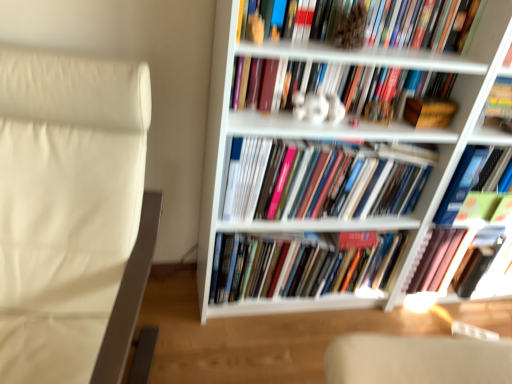
Question: In which direction should I rotate to look at multicolored paperbacks at center, acting as the fifth book starting from the top?

Choices:
 (A) left
 (B) right

Answer: (B)

Question: Considering the relative sizes of hardcover book at upper center, the first book when ordered from top to bottom, and matte hardcover books at center, the 3th book in the top-to-bottom sequence, in the image provided, is hardcover book at upper center, the first book when ordered from top to bottom, shorter than matte hardcover books at center, the 3th book in the top-to-bottom sequence,?

Choices:
 (A) no
 (B) yes

Answer: (B)

Question: From a real-world perspective, is hardcover book at upper center, the 6th book in the bottom-to-top sequence, beneath matte hardcover books at center, the 3th book in the top-to-bottom sequence?

Choices:
 (A) yes
 (B) no

Answer: (B)

Question: Is hardcover book at upper center, the first book when ordered from top to bottom, aimed at matte hardcover books at center, which is the fourth book from bottom to top?

Choices:
 (A) yes
 (B) no

Answer: (B)

Question: Does hardcover book at upper center, the first book when ordered from top to bottom, contain matte hardcover books at center, the 3th book in the top-to-bottom sequence?

Choices:
 (A) yes
 (B) no

Answer: (B)

Question: Considering the relative sizes of hardcover book at upper center, the 6th book in the bottom-to-top sequence, and matte hardcover books at center, which is the fourth book from bottom to top, in the image provided, is hardcover book at upper center, the 6th book in the bottom-to-top sequence, taller than matte hardcover books at center, which is the fourth book from bottom to top,?

Choices:
 (A) yes
 (B) no

Answer: (B)

Question: Is hardcover book at upper center, the first book when ordered from top to bottom, beside matte hardcover books at center, which is the fourth book from bottom to top?

Choices:
 (A) yes
 (B) no

Answer: (B)

Question: Considering the relative sizes of matte hardcover books at center, the 3th book in the top-to-bottom sequence, and multicolored paperbacks at center, acting as the fifth book starting from the top, in the image provided, is matte hardcover books at center, the 3th book in the top-to-bottom sequence, thinner than multicolored paperbacks at center, acting as the fifth book starting from the top,?

Choices:
 (A) yes
 (B) no

Answer: (A)

Question: Is multicolored paperbacks at center, acting as the 2th book starting from the bottom, at the back of matte hardcover books at center, which is the fourth book from bottom to top?

Choices:
 (A) no
 (B) yes

Answer: (A)

Question: Does matte hardcover books at center, the 3th book in the top-to-bottom sequence, turn towards multicolored paperbacks at center, acting as the fifth book starting from the top?

Choices:
 (A) no
 (B) yes

Answer: (A)

Question: From the image's perspective, is matte hardcover books at center, the 3th book in the top-to-bottom sequence, located beneath multicolored paperbacks at center, acting as the fifth book starting from the top?

Choices:
 (A) no
 (B) yes

Answer: (A)

Question: From a real-world perspective, is matte hardcover books at center, which is the fourth book from bottom to top, beneath multicolored paperbacks at center, acting as the fifth book starting from the top?

Choices:
 (A) yes
 (B) no

Answer: (B)

Question: Considering the relative sizes of matte hardcover books at center, the 3th book in the top-to-bottom sequence, and multicolored paperbacks at center, acting as the 2th book starting from the bottom, in the image provided, is matte hardcover books at center, the 3th book in the top-to-bottom sequence, taller than multicolored paperbacks at center, acting as the 2th book starting from the bottom,?

Choices:
 (A) yes
 (B) no

Answer: (B)

Question: From a real-world perspective, is hardcover book at center, the sixth book positioned from the top, located higher than hardcover book at upper center, the first book when ordered from top to bottom?

Choices:
 (A) no
 (B) yes

Answer: (A)